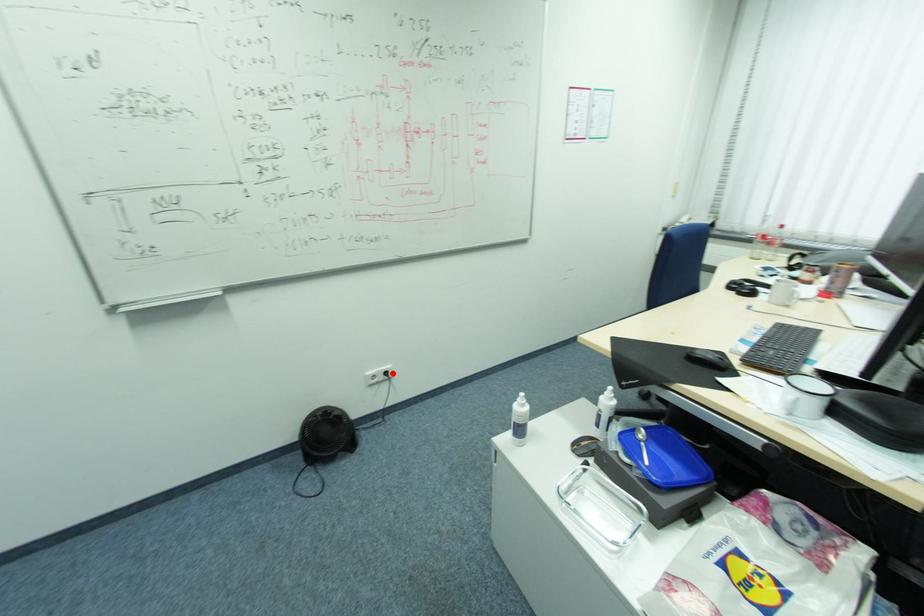
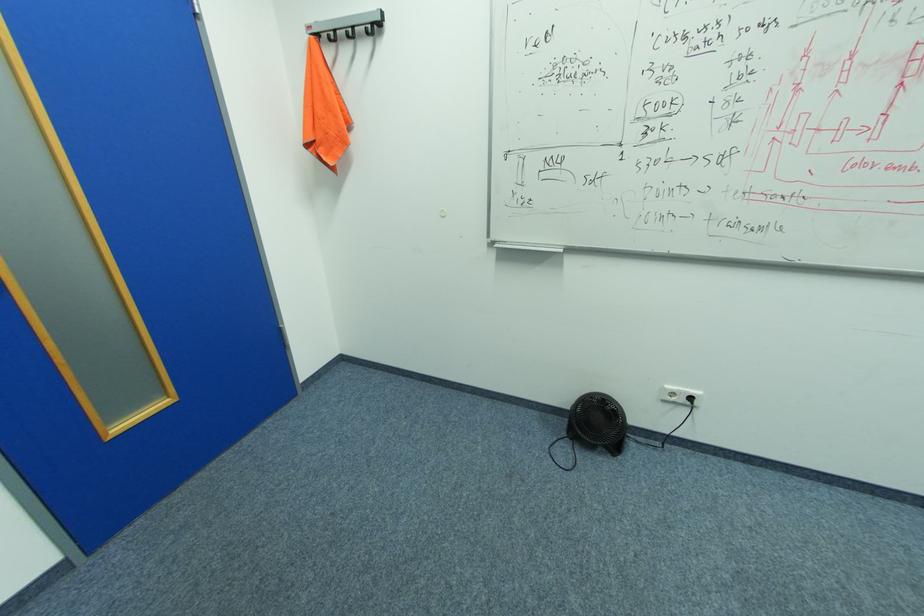
The point at the highlighted location is marked in the first image. Where is the corresponding point in the second image?

(698, 399)